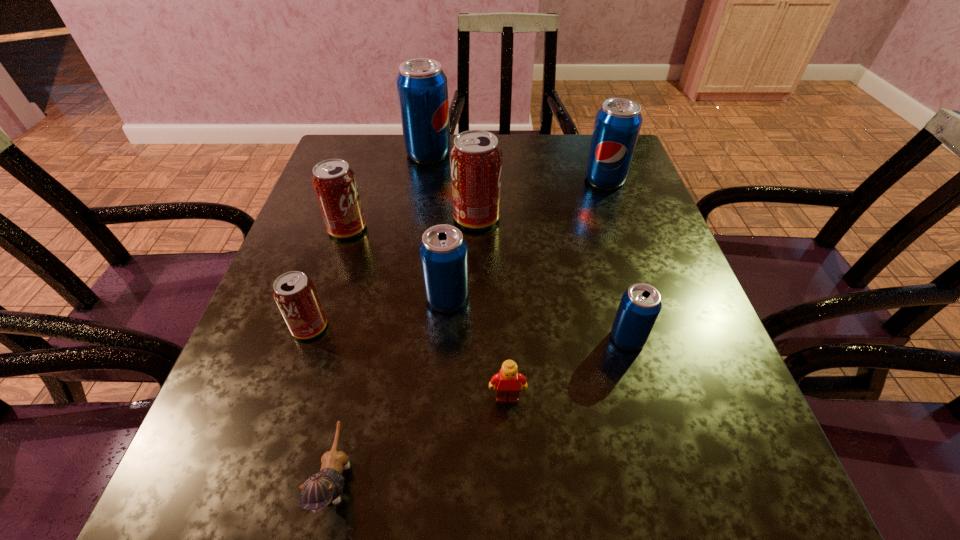
Where is `object that is positioned at the near edge`? The width and height of the screenshot is (960, 540). object that is positioned at the near edge is located at coordinates (320, 489).

Where is `object at the far right corner`? The height and width of the screenshot is (540, 960). object at the far right corner is located at coordinates (617, 125).

Where is `free space at the near edge of the desktop`? free space at the near edge of the desktop is located at coordinates (416, 467).

Find the location of a particular element. vacant space at the left edge of the desktop is located at coordinates (271, 293).

This screenshot has width=960, height=540. In the image, there is a desktop. Find the location of `vacant region at the far left corner`. vacant region at the far left corner is located at coordinates (345, 154).

I want to click on free space at the near left corner, so click(200, 496).

Locate an element on the screen. The image size is (960, 540). free location at the far right corner of the desktop is located at coordinates (582, 137).

Locate an element on the screen. vacant space at the near right corner is located at coordinates (774, 480).

Locate an element on the screen. The width and height of the screenshot is (960, 540). vacant space that is in between the nearest object and the smallest red soda can is located at coordinates (324, 403).

I want to click on free space between the biggest red soda can and the smallest red soda can, so click(x=393, y=272).